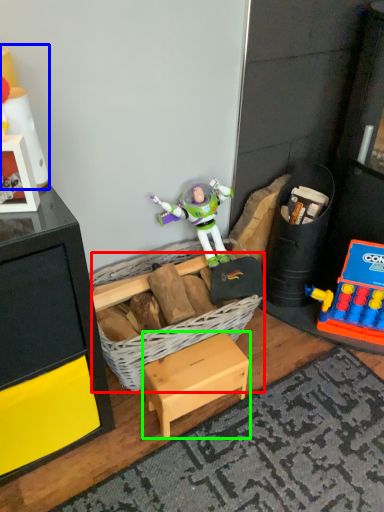
Question: Which is nearer to the basket (highlighted by a red box)? toy (highlighted by a blue box) or furniture (highlighted by a green box).

Choices:
 (A) toy
 (B) furniture

Answer: (B)